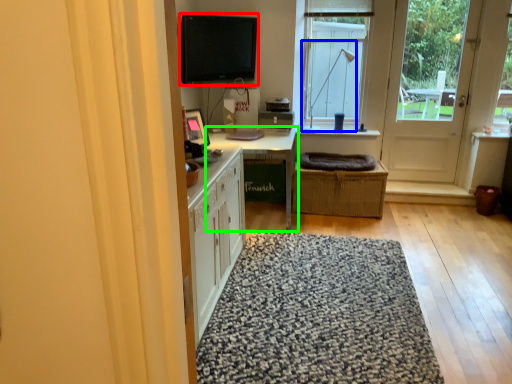
Question: Considering the real-world distances, which object is farthest from computer monitor (highlighted by a red box)? lamp (highlighted by a blue box) or table (highlighted by a green box)?

Choices:
 (A) lamp
 (B) table

Answer: (A)